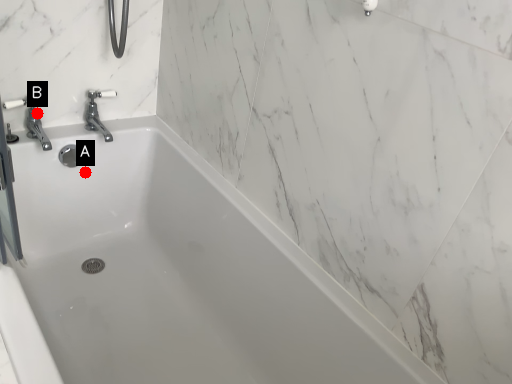
Question: Two points are circled on the image, labeled by A and B beside each circle. Which point is further to the camera?

Choices:
 (A) A is further
 (B) B is further

Answer: (A)